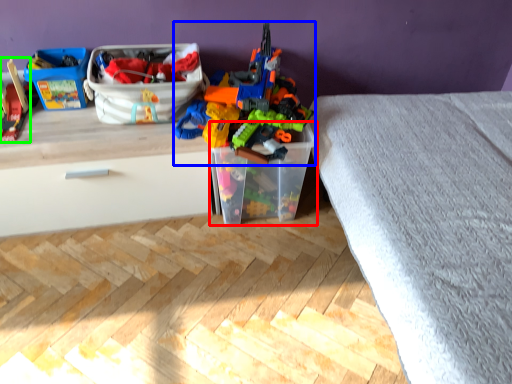
Question: Which object is the closest to the storage box (highlighted by a red box)? Choose among these: toy (highlighted by a blue box) or toy (highlighted by a green box).

Choices:
 (A) toy
 (B) toy

Answer: (A)